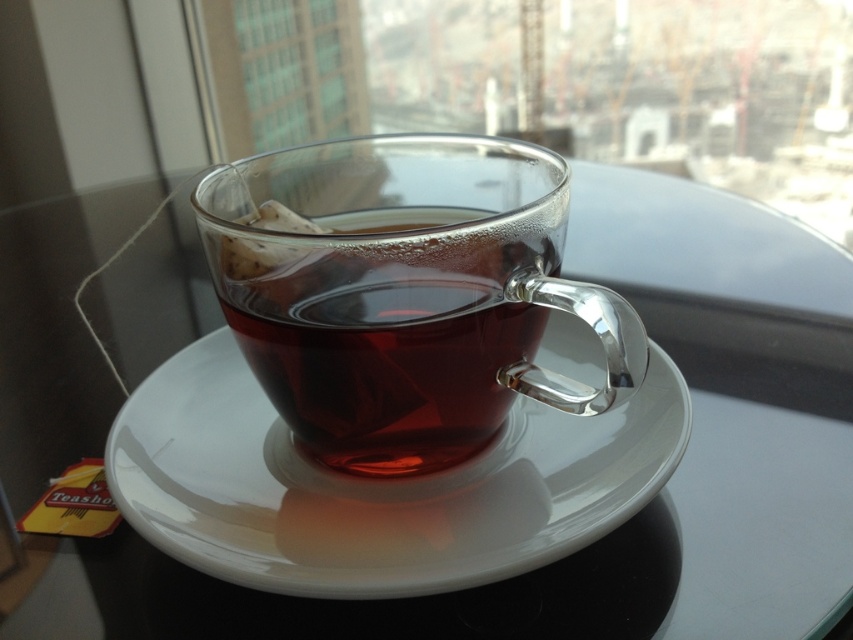
You are a waiter in a cafe and need to place a white glossy saucer at center and a transparent glass cup at center on a table. The customer has requested that the cup must be placed above the saucer to prevent spills. Can you arrange them correctly according to the customer request?

Yes, the white glossy saucer at center is located below the transparent glass cup at center, so the arrangement already meets the customer request.

You are a barista preparing a drink and need to place the transparent glass cup at center on the white glossy saucer at center. According to the scene, is the saucer positioned correctly to the right of the cup?

The white glossy saucer at center is to the right of the transparent glass cup at center, so yes, the saucer is positioned correctly to the right of the cup.

You are standing in a room with a window showing a cityscape. You see a transparent glass teacup with a tea bag on a saucer. Where is the saucer located relative to the point marked by coordinates (375, 484)?

The white glossy saucer at center is located exactly at the coordinates (375, 484).